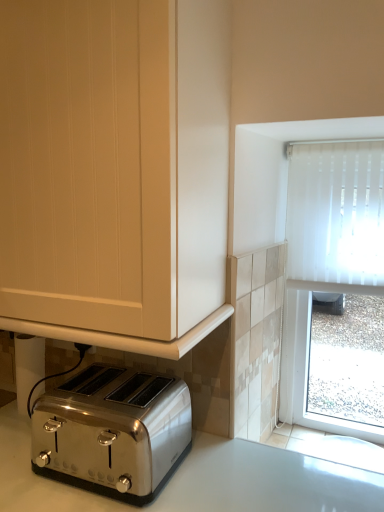
Locate an element on the screen. Image resolution: width=384 pixels, height=512 pixels. vacant space situated above satin silver toaster at lower left (from a real-world perspective) is located at coordinates (112, 385).